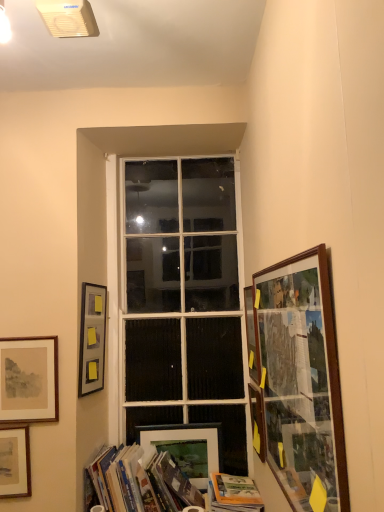
You are a GUI agent. You are given a task and a screenshot of the screen. Output one action in this format:
    pyautogui.click(x=<x>, y=<y>)
    Task: Click on the matte gray picture frame at upper left, the 5th picture frame when ordered from right to left
    The width and height of the screenshot is (384, 512).
    Given the screenshot: What is the action you would take?
    pyautogui.click(x=92, y=338)

Measure the distance between hardcover books at lower center, acting as the 1th book starting from the left, and camera.

They are 1.82 meters apart.

At what (x,y) coordinates should I click in order to perform the action: click on matte brown picture frame at lower left, the first picture frame positioned from the left. Please return your answer as a coordinate pair (x, y). Looking at the image, I should click on (15, 461).

Image resolution: width=384 pixels, height=512 pixels. What do you see at coordinates (235, 493) in the screenshot?
I see `orange matte book at lower center, which appears as the second book when viewed from the left` at bounding box center [235, 493].

At what (x,y) coordinates should I click in order to perform the action: click on matte paper picture frame at lower left, which appears as the 6th picture frame when viewed from the right. Please return your answer as a coordinate pair (x, y). The image size is (384, 512). Looking at the image, I should click on (29, 379).

Find the location of `matte white picture frame at lower center, which is the fourth picture frame in left-to-right order`. matte white picture frame at lower center, which is the fourth picture frame in left-to-right order is located at coordinates (188, 448).

In order to click on wooden framed map at right, arranged as the 1th picture frame when viewed from the right in this screenshot , I will do `click(257, 421)`.

From a real-world perspective, starting from the orange matte book at lower center, which appears as the second book when viewed from the left, which picture frame is the 6th one vertically above it? Please provide its 2D coordinates.

[(251, 334)]

Is orange matte book at lower center, placed as the 1th book when sorted from right to left, aimed at wooden picture frame at right, the 3th picture frame positioned from the right?

No, orange matte book at lower center, placed as the 1th book when sorted from right to left, does not turn towards wooden picture frame at right, the 3th picture frame positioned from the right.

Between orange matte book at lower center, which appears as the second book when viewed from the left, and wooden picture frame at right, the fifth picture frame when ordered from left to right, which one has smaller size?

wooden picture frame at right, the fifth picture frame when ordered from left to right.

From a real-world perspective, which is physically above, orange matte book at lower center, placed as the 1th book when sorted from right to left, or wooden picture frame at right, the 3th picture frame positioned from the right?

wooden picture frame at right, the 3th picture frame positioned from the right, is physically above.

Is orange matte book at lower center, which appears as the second book when viewed from the left, shorter than hardcover books at lower center, the 2th book viewed from the right?

Yes.

Considering the sizes of objects orange matte book at lower center, placed as the 1th book when sorted from right to left, and hardcover books at lower center, acting as the 1th book starting from the left, in the image provided, who is bigger, orange matte book at lower center, placed as the 1th book when sorted from right to left, or hardcover books at lower center, acting as the 1th book starting from the left,?

Bigger between the two is hardcover books at lower center, acting as the 1th book starting from the left.

Is orange matte book at lower center, placed as the 1th book when sorted from right to left, spatially inside hardcover books at lower center, acting as the 1th book starting from the left, or outside of it?

orange matte book at lower center, placed as the 1th book when sorted from right to left, lies outside hardcover books at lower center, acting as the 1th book starting from the left.

Is orange matte book at lower center, which appears as the second book when viewed from the left, wider than hardcover books at lower center, the 2th book viewed from the right?

Yes, orange matte book at lower center, which appears as the second book when viewed from the left, is wider than hardcover books at lower center, the 2th book viewed from the right.

Which object is closer to the camera, wooden picture frame at right, the fifth picture frame when ordered from left to right, or matte paper picture frame at lower left, the second picture frame when ordered from left to right?

wooden picture frame at right, the fifth picture frame when ordered from left to right.

Which of these two, wooden picture frame at right, the 3th picture frame positioned from the right, or matte paper picture frame at lower left, the second picture frame when ordered from left to right, is bigger?

wooden picture frame at right, the 3th picture frame positioned from the right, is bigger.

Considering the points (253, 323) and (57, 404), which point is behind, point (253, 323) or point (57, 404)?

Positioned behind is point (253, 323).

Is there a large distance between wooden picture frame at right, the fifth picture frame when ordered from left to right, and matte paper picture frame at lower left, the second picture frame when ordered from left to right?

wooden picture frame at right, the fifth picture frame when ordered from left to right, is actually quite close to matte paper picture frame at lower left, the second picture frame when ordered from left to right.

Is matte brown picture frame at lower left, the first picture frame positioned from the left, completely or partially outside of wooden picture frame at right, the fifth picture frame when ordered from left to right?

Absolutely, matte brown picture frame at lower left, the first picture frame positioned from the left, is external to wooden picture frame at right, the fifth picture frame when ordered from left to right.

Which object is positioned more to the left, matte brown picture frame at lower left, marked as the seventh picture frame in a right-to-left arrangement, or wooden picture frame at right, the fifth picture frame when ordered from left to right?

Positioned to the left is matte brown picture frame at lower left, marked as the seventh picture frame in a right-to-left arrangement.

From a real-world perspective, between matte brown picture frame at lower left, the first picture frame positioned from the left, and wooden picture frame at right, the fifth picture frame when ordered from left to right, who is vertically higher?

wooden picture frame at right, the fifth picture frame when ordered from left to right, is physically above.

In terms of size, does matte brown picture frame at lower left, marked as the seventh picture frame in a right-to-left arrangement, appear bigger or smaller than wooden picture frame at right, the fifth picture frame when ordered from left to right?

In the image, matte brown picture frame at lower left, marked as the seventh picture frame in a right-to-left arrangement, appears to be larger than wooden picture frame at right, the fifth picture frame when ordered from left to right.

Between wooden picture frame at right, the 3th picture frame positioned from the right, and matte brown picture frame at lower left, marked as the seventh picture frame in a right-to-left arrangement, which one has larger size?

Bigger between the two is matte brown picture frame at lower left, marked as the seventh picture frame in a right-to-left arrangement.

In the scene shown: From the image's perspective, does wooden picture frame at right, the fifth picture frame when ordered from left to right, appear lower than matte brown picture frame at lower left, the first picture frame positioned from the left?

No.

How many degrees apart are the facing directions of wooden picture frame at right, the 3th picture frame positioned from the right, and matte brown picture frame at lower left, marked as the seventh picture frame in a right-to-left arrangement?

wooden picture frame at right, the 3th picture frame positioned from the right, and matte brown picture frame at lower left, marked as the seventh picture frame in a right-to-left arrangement, are facing 89.4 degrees away from each other.

Is wooden picture frame at right, the fifth picture frame when ordered from left to right, with matte brown picture frame at lower left, the first picture frame positioned from the left?

No, wooden picture frame at right, the fifth picture frame when ordered from left to right, is not touching matte brown picture frame at lower left, the first picture frame positioned from the left.

Based on the photo, which of these two, white glass window at center or matte brown picture frame at lower left, marked as the seventh picture frame in a right-to-left arrangement, is wider?

Wider between the two is white glass window at center.

Is point (222, 280) farther from camera compared to point (23, 437)?

Yes, point (222, 280) is behind point (23, 437).

Is white glass window at center facing towards matte brown picture frame at lower left, marked as the seventh picture frame in a right-to-left arrangement?

No, white glass window at center is not aimed at matte brown picture frame at lower left, marked as the seventh picture frame in a right-to-left arrangement.

From a real-world perspective, which object rests below the other?

matte brown picture frame at lower left, marked as the seventh picture frame in a right-to-left arrangement, from a real-world perspective.

From the image's perspective, which one is positioned higher, matte white picture frame at lower center, the 4th picture frame when ordered from right to left, or matte brown picture frame at lower left, marked as the seventh picture frame in a right-to-left arrangement?

matte brown picture frame at lower left, marked as the seventh picture frame in a right-to-left arrangement, is shown above in the image.

Are matte white picture frame at lower center, which is the fourth picture frame in left-to-right order, and matte brown picture frame at lower left, the first picture frame positioned from the left, beside each other?

No, matte white picture frame at lower center, which is the fourth picture frame in left-to-right order, is not making contact with matte brown picture frame at lower left, the first picture frame positioned from the left.

Does point (196, 428) come closer to viewer compared to point (22, 451)?

No.

From the picture: Does matte white picture frame at lower center, the 4th picture frame when ordered from right to left, lie in front of matte brown picture frame at lower left, the first picture frame positioned from the left?

That is False.

From a real-world perspective, which picture frame is the 6th one above the orange matte book at lower center, placed as the 1th book when sorted from right to left? Please provide its 2D coordinates.

[(251, 334)]

Identify the location of book that appears below the hardcover books at lower center, the 2th book viewed from the right (from a real-world perspective). The image size is (384, 512). (235, 493).

Looking at this image, when comparing their distances from matte white picture frame at lower center, the 4th picture frame when ordered from right to left, does matte brown picture frame at lower left, the first picture frame positioned from the left, or white glass window at center seem closer?

Based on the image, white glass window at center appears to be nearer to matte white picture frame at lower center, the 4th picture frame when ordered from right to left.

Estimate the real-world distances between objects in this image. Which object is closer to hardcover books at lower center, the 2th book viewed from the right, matte white picture frame at lower center, the 4th picture frame when ordered from right to left, or wooden picture frame at right, the 3th picture frame positioned from the right?

matte white picture frame at lower center, the 4th picture frame when ordered from right to left, is closer to hardcover books at lower center, the 2th book viewed from the right.

Estimate the real-world distances between objects in this image. Which object is closer to wooden framed map at right, arranged as the 1th picture frame when viewed from the right, wooden picture frame at right, the fifth picture frame when ordered from left to right, or hardcover books at lower center, acting as the 1th book starting from the left?

wooden picture frame at right, the fifth picture frame when ordered from left to right, is closer to wooden framed map at right, arranged as the 1th picture frame when viewed from the right.

Looking at the image, which one is located further to matte white picture frame at lower center, which is the fourth picture frame in left-to-right order, matte gray picture frame at upper left, which is the third picture frame from left to right, or matte paper picture frame at lower left, which appears as the 6th picture frame when viewed from the right?

matte paper picture frame at lower left, which appears as the 6th picture frame when viewed from the right, is positioned further to the anchor matte white picture frame at lower center, which is the fourth picture frame in left-to-right order.

Which object lies nearer to the anchor point matte paper picture frame at lower left, the second picture frame when ordered from left to right, orange matte book at lower center, which appears as the second book when viewed from the left, or hardcover books at lower center, acting as the 1th book starting from the left?

Based on the image, hardcover books at lower center, acting as the 1th book starting from the left, appears to be nearer to matte paper picture frame at lower left, the second picture frame when ordered from left to right.

Estimate the real-world distances between objects in this image. Which object is further from hardcover books at lower center, acting as the 1th book starting from the left, orange matte book at lower center, placed as the 1th book when sorted from right to left, or wooden-framed collage at right, placed as the second picture frame when sorted from right to left?

The object further to hardcover books at lower center, acting as the 1th book starting from the left, is wooden-framed collage at right, placed as the second picture frame when sorted from right to left.

Looking at the image, which one is located further to hardcover books at lower center, the 2th book viewed from the right, wooden-framed collage at right, arranged as the sixth picture frame when viewed from the left, or orange matte book at lower center, which appears as the second book when viewed from the left?

wooden-framed collage at right, arranged as the sixth picture frame when viewed from the left, is positioned further to the anchor hardcover books at lower center, the 2th book viewed from the right.

From the image, which object appears to be farther from wooden framed map at right, positioned as the seventh picture frame in left-to-right order, white glass window at center or matte brown picture frame at lower left, marked as the seventh picture frame in a right-to-left arrangement?

Among the two, matte brown picture frame at lower left, marked as the seventh picture frame in a right-to-left arrangement, is located further to wooden framed map at right, positioned as the seventh picture frame in left-to-right order.

Where is `book located between wooden-framed collage at right, arranged as the sixth picture frame when viewed from the left, and orange matte book at lower center, placed as the 1th book when sorted from right to left, in the depth direction`? book located between wooden-framed collage at right, arranged as the sixth picture frame when viewed from the left, and orange matte book at lower center, placed as the 1th book when sorted from right to left, in the depth direction is located at coordinates (140, 481).

Locate an element on the screen. book between matte paper picture frame at lower left, the second picture frame when ordered from left to right, and matte white picture frame at lower center, the 4th picture frame when ordered from right to left, from left to right is located at coordinates (140, 481).

Find the location of a particular element. picture frame between matte paper picture frame at lower left, which appears as the 6th picture frame when viewed from the right, and matte white picture frame at lower center, which is the fourth picture frame in left-to-right order, from left to right is located at coordinates (92, 338).

The height and width of the screenshot is (512, 384). What are the coordinates of `window between wooden-framed collage at right, arranged as the sixth picture frame when viewed from the left, and matte white picture frame at lower center, which is the fourth picture frame in left-to-right order, from front to back` in the screenshot? It's located at (182, 300).